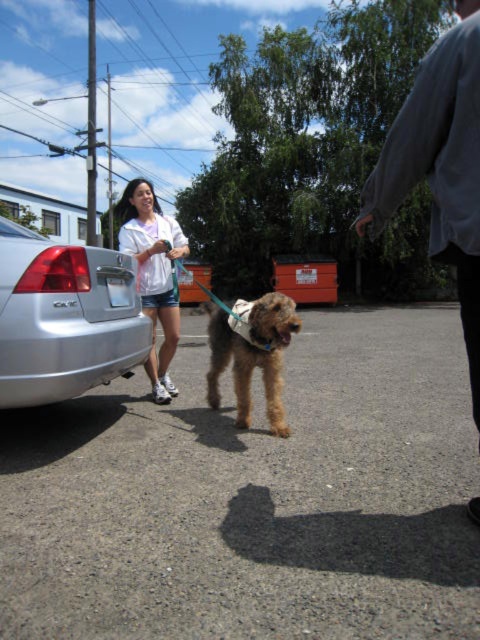
Question: Which point is farther to the camera?

Choices:
 (A) (249, 360)
 (B) (36, 380)
 (C) (156, 372)

Answer: (C)

Question: Does gray fabric shirt at upper right come behind white fabric jacket at upper center?

Choices:
 (A) no
 (B) yes

Answer: (A)

Question: Is silver metallic car at lower left closer to camera compared to gray fabric shirt at upper right?

Choices:
 (A) no
 (B) yes

Answer: (A)

Question: Among these objects, which one is nearest to the camera?

Choices:
 (A) fuzzy brown dog at center
 (B) silver metallic car at lower left

Answer: (B)

Question: Is silver metallic car at lower left to the right of white fabric jacket at upper center from the viewer's perspective?

Choices:
 (A) yes
 (B) no

Answer: (A)

Question: Which point is farther from the camera taking this photo?

Choices:
 (A) (118, 298)
 (B) (152, 378)
 (C) (459, 131)

Answer: (B)